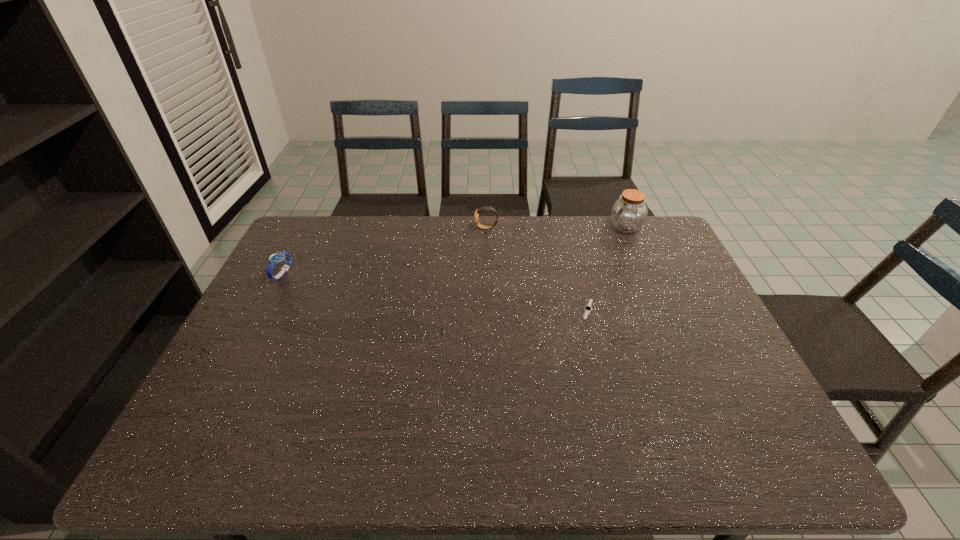
You are a GUI agent. You are given a task and a screenshot of the screen. Output one action in this format:
    pyautogui.click(x=<x>, y=<y>)
    Task: Click on the unoccupied area between the rightmost object and the second shortest object
    The image size is (960, 540).
    Given the screenshot: What is the action you would take?
    pyautogui.click(x=454, y=250)

The image size is (960, 540). I want to click on vacant space that's between the jar and the second farthest watch, so click(x=454, y=250).

This screenshot has height=540, width=960. In order to click on empty space that is in between the second nearest object and the jar in this screenshot , I will do `click(454, 250)`.

Where is `object that is the third closest to the rightmost watch`? object that is the third closest to the rightmost watch is located at coordinates (276, 258).

Choose which object is the third nearest neighbor to the rightmost object. Please provide its 2D coordinates. Your answer should be formatted as a tuple, i.e. [(x, y)], where the tuple contains the x and y coordinates of a point satisfying the conditions above.

[(276, 258)]

Locate an element on the screen. The width and height of the screenshot is (960, 540). watch that is the closest to the farthest watch is located at coordinates (588, 308).

Image resolution: width=960 pixels, height=540 pixels. I want to click on watch that stands as the closest to the tallest object, so click(x=588, y=308).

Identify the location of vacant space that satisfies the following two spatial constraints: 1. on the back side of the shortest object; 2. on the face of the third shortest object. The width and height of the screenshot is (960, 540). (567, 228).

Identify the location of vacant position in the image that satisfies the following two spatial constraints: 1. on the face of the second watch from left to right; 2. on the right side of the third object from left to right. (489, 309).

Locate an element on the screen. free point that satisfies the following two spatial constraints: 1. on the face of the tallest watch; 2. on the front side of the leftmost object is located at coordinates (488, 273).